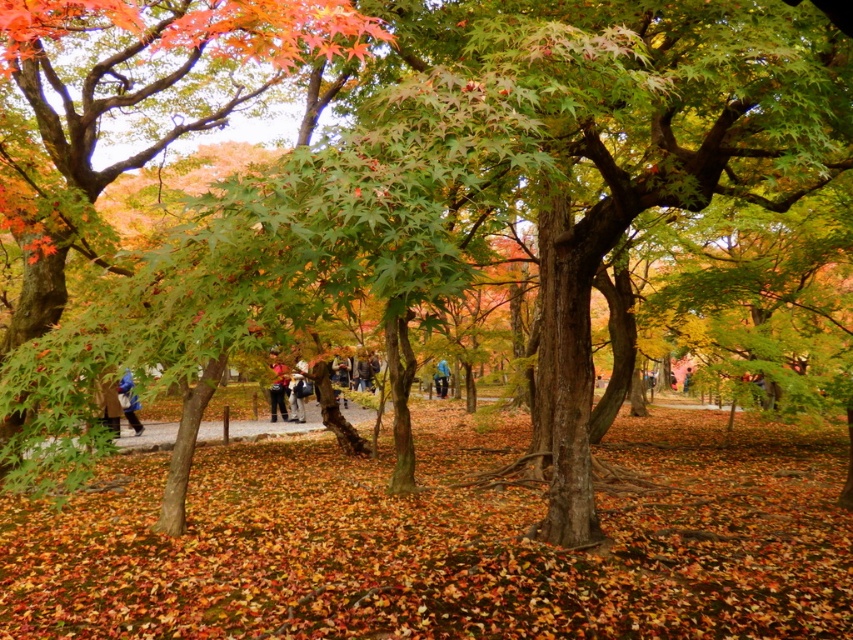
Describe the element at coordinates (129, 401) in the screenshot. I see `blue fabric jacket at lower left` at that location.

Between blue fabric jacket at lower left and blue fabric jacket at center, which one is positioned lower?

blue fabric jacket at center is below.

Is point (126, 371) closer to viewer compared to point (439, 371)?

Yes.

The width and height of the screenshot is (853, 640). I want to click on blue fabric jacket at lower left, so click(x=129, y=401).